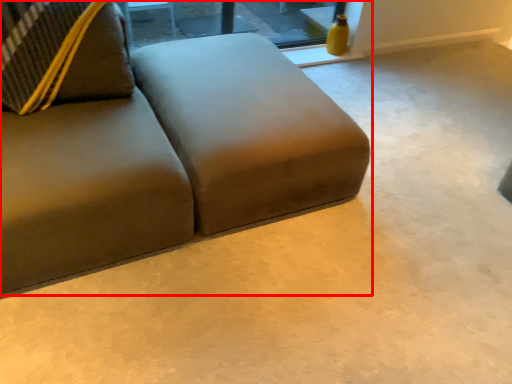
Question: Where is studio couch (annotated by the red box) located in relation to window in the image?

Choices:
 (A) left
 (B) right

Answer: (A)